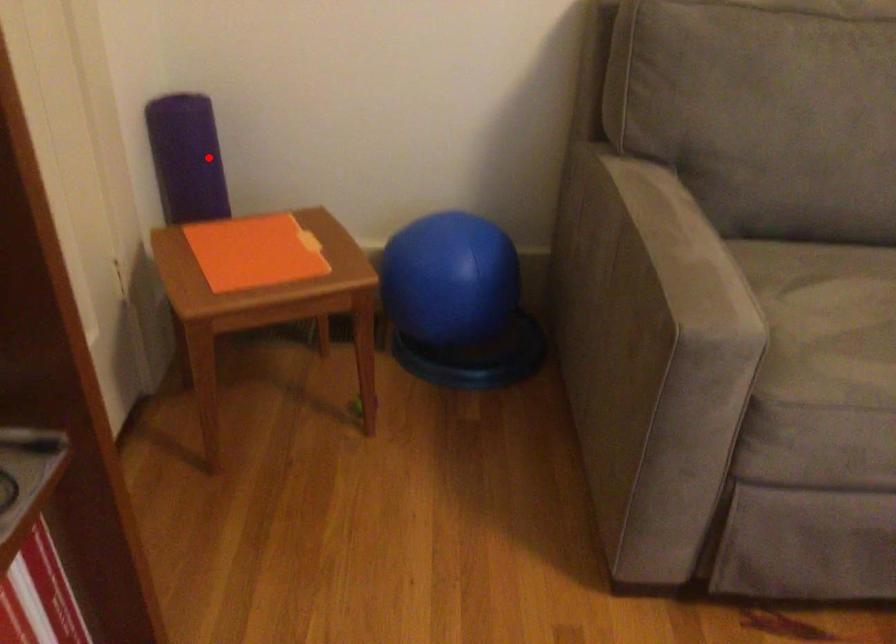
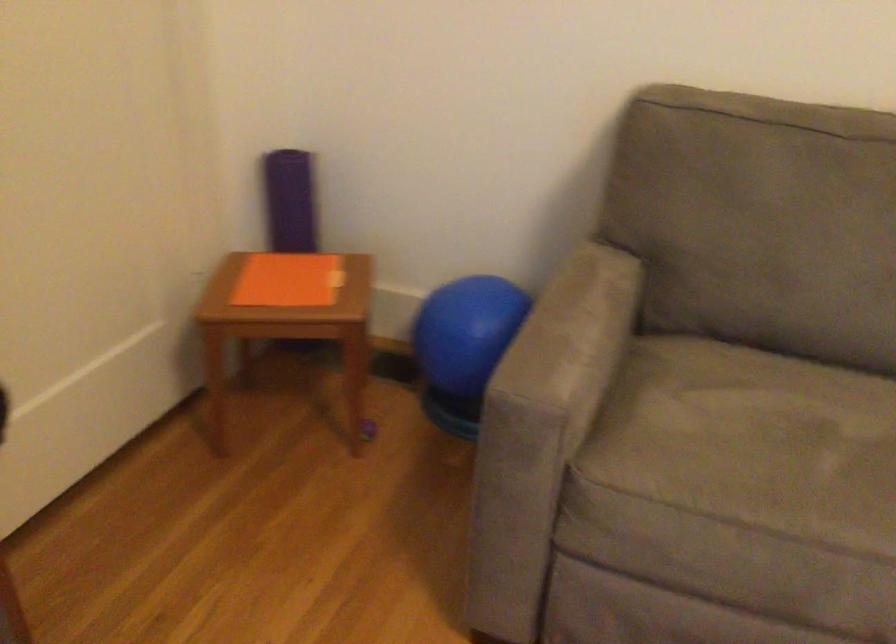
Question: I am providing you with two images of the same scene from different viewpoints. A red point is marked on the first image. At the location where the point appears in image 1, is it still visible in image 2?

Choices:
 (A) Yes
 (B) No

Answer: (A)